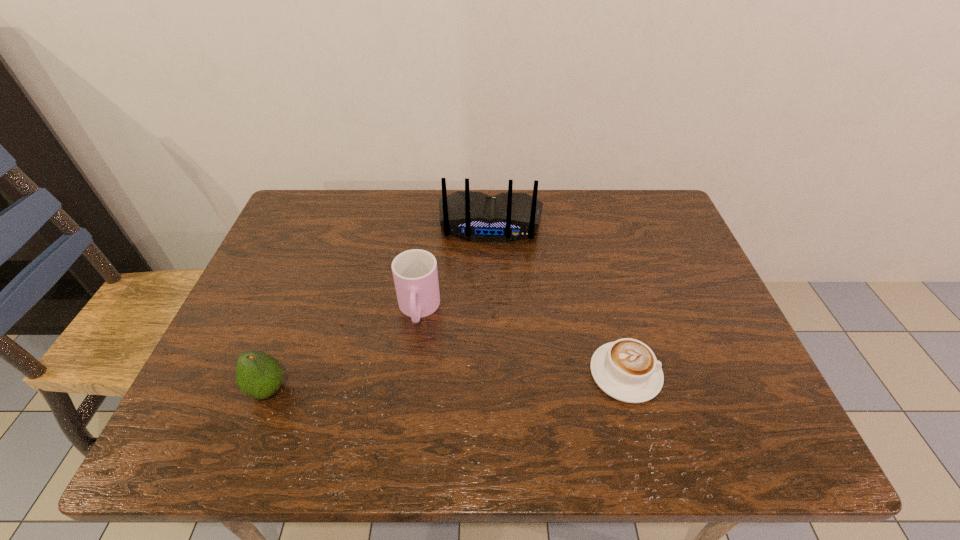
Find the location of `free space located 0.180m on the back of the farthest object`. free space located 0.180m on the back of the farthest object is located at coordinates click(x=486, y=295).

I want to click on vacant space located 0.170m with the handle on the side of the cup, so click(410, 401).

Find the location of a particular element. The image size is (960, 540). vacant space located with the handle on the side of the cup is located at coordinates (413, 376).

Identify the location of vacant space located 0.100m with the handle on the side of the cup. This screenshot has height=540, width=960. (413, 372).

The image size is (960, 540). Identify the location of object located at the far edge. (476, 216).

Where is `avocado at the near edge`? The width and height of the screenshot is (960, 540). avocado at the near edge is located at coordinates pos(258,375).

This screenshot has width=960, height=540. Find the location of `cappuccino at the near edge`. cappuccino at the near edge is located at coordinates (627, 370).

Find the location of a particular element. The width and height of the screenshot is (960, 540). object that is at the left edge is located at coordinates (258, 375).

What are the coordinates of `object that is positioned at the near left corner` in the screenshot? It's located at (258, 375).

Identify the location of vacant region at the far edge of the desktop. The height and width of the screenshot is (540, 960). (375, 210).